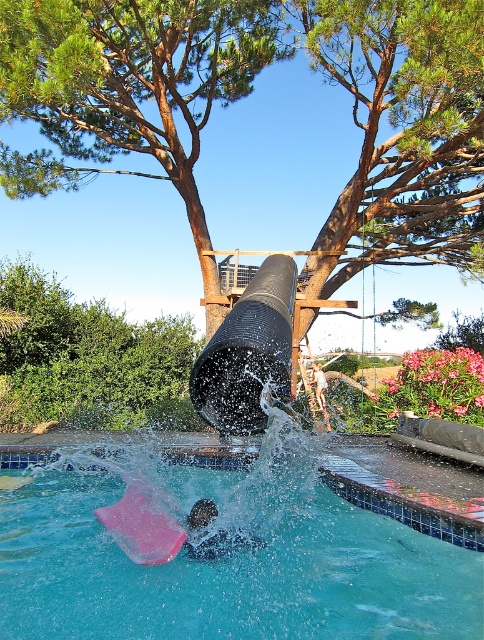
Is point (53, 408) less distant than point (283, 289)?

That is False.

Looking at this image, between brown wood tree at upper center and black rubber tube at center, which one appears on the right side from the viewer's perspective?

Positioned to the right is black rubber tube at center.

Is point (182, 401) positioned before point (258, 296)?

That is False.

This screenshot has height=640, width=484. In order to click on brown wood tree at upper center in this screenshot , I will do `click(90, 360)`.

Looking at this image, can you confirm if pink rubber slide at lower center is bigger than dark matte swim cap at lower center?

Indeed, pink rubber slide at lower center has a larger size compared to dark matte swim cap at lower center.

Based on the photo, does pink rubber slide at lower center lie behind dark matte swim cap at lower center?

No, it is not.

The image size is (484, 640). Identify the location of pink rubber slide at lower center. 142,524.

Which is more to the left, transparent plastic pool at center or dark matte swim cap at lower center?

From the viewer's perspective, transparent plastic pool at center appears more on the left side.

Can you confirm if transparent plastic pool at center is positioned below dark matte swim cap at lower center?

No, transparent plastic pool at center is not below dark matte swim cap at lower center.

Who is more forward, (457, 577) or (193, 532)?

Point (457, 577) is more forward.

You are a GUI agent. You are given a task and a screenshot of the screen. Output one action in this format:
    pyautogui.click(x=<x>, y=<y>)
    Task: Click on the transparent plastic pool at center
    Image resolution: width=484 pixels, height=640 pixels.
    Given the screenshot: What is the action you would take?
    pyautogui.click(x=226, y=560)